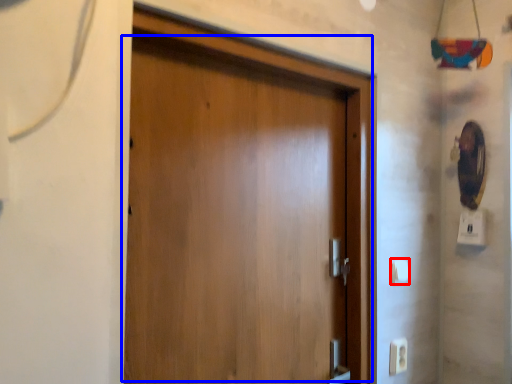
Question: Which of the following is the closest to the observer, light switch (highlighted by a red box) or door (highlighted by a blue box)?

Choices:
 (A) light switch
 (B) door

Answer: (B)